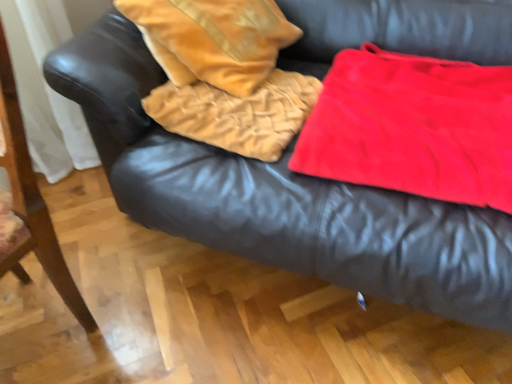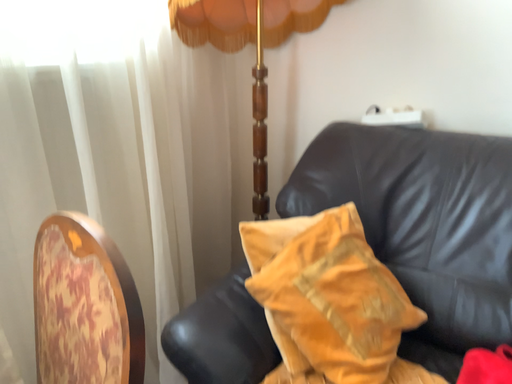
Question: Which way did the camera rotate in the video?

Choices:
 (A) rotated downward
 (B) rotated upward

Answer: (B)